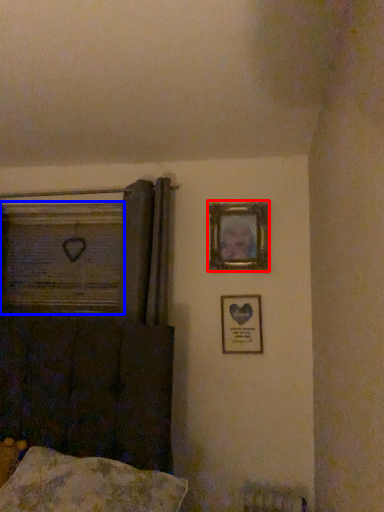
Question: Which point is closer to the camera, picture frame (highlighted by a red box) or window frame (highlighted by a blue box)?

Choices:
 (A) picture frame
 (B) window frame

Answer: (A)